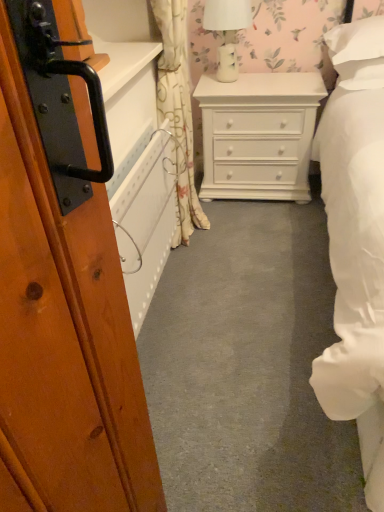
What is the approximate height of floral fabric curtain at center?

floral fabric curtain at center is 98.19 centimeters in height.

You are a GUI agent. You are given a task and a screenshot of the screen. Output one action in this format:
    pyautogui.click(x=<x>, y=<y>)
    Task: Click on the white painted wood chest of drawers at center
    
    Given the screenshot: What is the action you would take?
    pyautogui.click(x=258, y=135)

Considering the relative positions of white glossy table lamp at upper center and white painted wood chest of drawers at center in the image provided, is white glossy table lamp at upper center to the right of white painted wood chest of drawers at center from the viewer's perspective?

Incorrect, white glossy table lamp at upper center is not on the right side of white painted wood chest of drawers at center.

In the scene shown: Is white glossy table lamp at upper center far away from white painted wood chest of drawers at center?

No, white glossy table lamp at upper center is in close proximity to white painted wood chest of drawers at center.

Is point (226, 57) positioned behind point (303, 149)?

No, (226, 57) is in front of (303, 149).

From a real-world perspective, is white glossy table lamp at upper center under floral fabric curtain at center?

Actually, white glossy table lamp at upper center is physically above floral fabric curtain at center in the real world.

Is white glossy table lamp at upper center inside the boundaries of floral fabric curtain at center, or outside?

white glossy table lamp at upper center lies outside floral fabric curtain at center.

Considering the relative sizes of white glossy table lamp at upper center and floral fabric curtain at center in the image provided, is white glossy table lamp at upper center taller than floral fabric curtain at center?

In fact, white glossy table lamp at upper center may be shorter than floral fabric curtain at center.

Does point (162, 115) come behind point (225, 84)?

No, (162, 115) is closer to viewer.

The width and height of the screenshot is (384, 512). What are the coordinates of `chest of drawers lying on the right of floral fabric curtain at center` in the screenshot? It's located at [x=258, y=135].

From the picture: Is floral fabric curtain at center not inside white painted wood chest of drawers at center?

Absolutely, floral fabric curtain at center is external to white painted wood chest of drawers at center.

Is floral fabric curtain at center taller or shorter than white painted wood chest of drawers at center?

Clearly, floral fabric curtain at center is taller compared to white painted wood chest of drawers at center.

Is floral fabric curtain at center in front of or behind white glossy table lamp at upper center in the image?

Clearly, floral fabric curtain at center is in front of white glossy table lamp at upper center.

From a real-world perspective, is floral fabric curtain at center physically located above or below white glossy table lamp at upper center?

floral fabric curtain at center is situated lower than white glossy table lamp at upper center in the real world.

Based on their positions, is floral fabric curtain at center located to the left or right of white glossy table lamp at upper center?

Clearly, floral fabric curtain at center is on the left of white glossy table lamp at upper center in the image.

Considering the sizes of objects floral fabric curtain at center and white glossy table lamp at upper center in the image provided, who is thinner, floral fabric curtain at center or white glossy table lamp at upper center?

floral fabric curtain at center is thinner.

Image resolution: width=384 pixels, height=512 pixels. I want to click on table lamp in front of the white painted wood chest of drawers at center, so [x=227, y=32].

Is white painted wood chest of drawers at center located outside white glossy table lamp at upper center?

Yes.

Which of these two, white painted wood chest of drawers at center or white glossy table lamp at upper center, stands taller?

white painted wood chest of drawers at center is taller.

Which is closer, (260,167) or (186,15)?

Point (260,167) appears to be farther away from the viewer than point (186,15).

From the image's perspective, between white painted wood chest of drawers at center and floral fabric curtain at center, which one is located above?

white painted wood chest of drawers at center appears higher in the image.

Would you say white painted wood chest of drawers at center is a long distance from floral fabric curtain at center?

No.

Locate an element on the screen. table lamp above the white painted wood chest of drawers at center (from the image's perspective) is located at coordinates (227, 32).

Locate an element on the screen. curtain below the white glossy table lamp at upper center (from a real-world perspective) is located at coordinates (178, 112).

From the image, which object appears to be farther from white glossy table lamp at upper center, white painted wood chest of drawers at center or floral fabric curtain at center?

floral fabric curtain at center lies further to white glossy table lamp at upper center than the other object.

Considering their positions, is floral fabric curtain at center positioned further to white painted wood chest of drawers at center than white glossy table lamp at upper center?

floral fabric curtain at center is positioned further to the anchor white painted wood chest of drawers at center.

In the scene shown: Considering their positions, is white painted wood chest of drawers at center positioned closer to floral fabric curtain at center than white glossy table lamp at upper center?

Among the two, white painted wood chest of drawers at center is located nearer to floral fabric curtain at center.

Estimate the real-world distances between objects in this image. Which object is closer to floral fabric curtain at center, white glossy table lamp at upper center or white painted wood chest of drawers at center?

The object closer to floral fabric curtain at center is white painted wood chest of drawers at center.

Considering their positions, is white glossy table lamp at upper center positioned closer to white painted wood chest of drawers at center than floral fabric curtain at center?

The object closer to white painted wood chest of drawers at center is white glossy table lamp at upper center.

From the image, which object appears to be nearer to white glossy table lamp at upper center, floral fabric curtain at center or white painted wood chest of drawers at center?

Among the two, white painted wood chest of drawers at center is located nearer to white glossy table lamp at upper center.

Where is `table lamp between floral fabric curtain at center and white painted wood chest of drawers at center from front to back`? This screenshot has width=384, height=512. table lamp between floral fabric curtain at center and white painted wood chest of drawers at center from front to back is located at coordinates (227, 32).